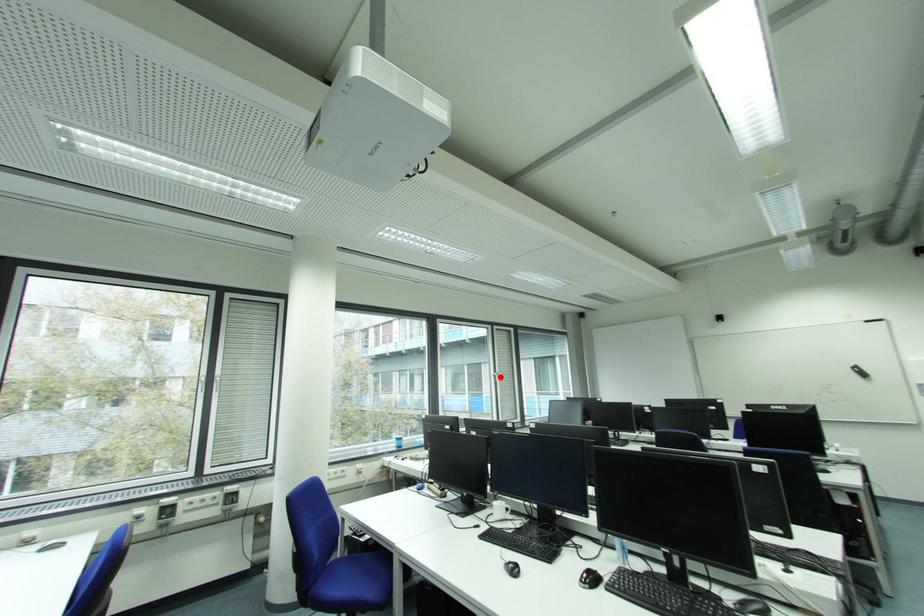
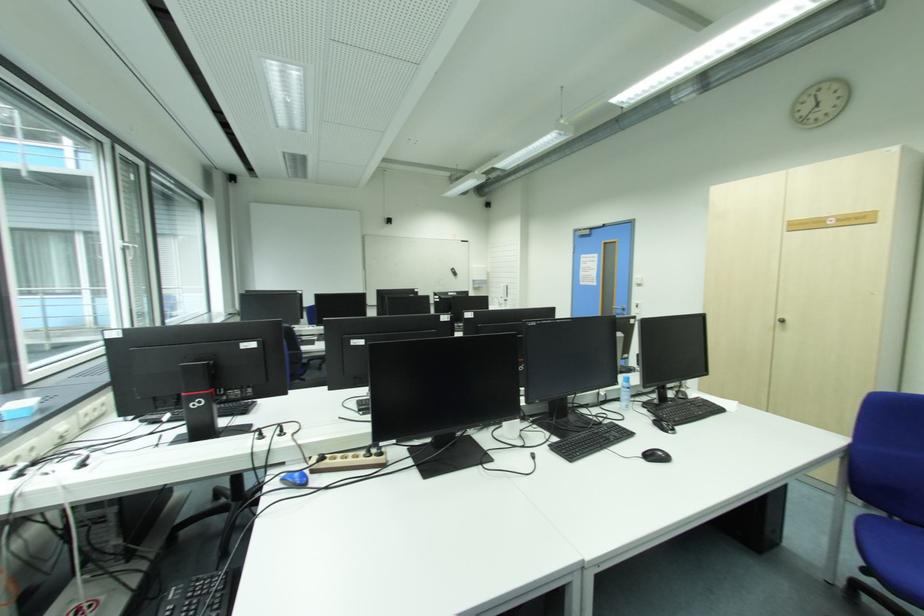
Question: I am providing you with two images of the same scene from different viewpoints. In image1, a red point is highlighted. Considering the same 3D point in image2, which of the following is correct?

Choices:
 (A) It is closer
 (B) It is farther

Answer: (A)